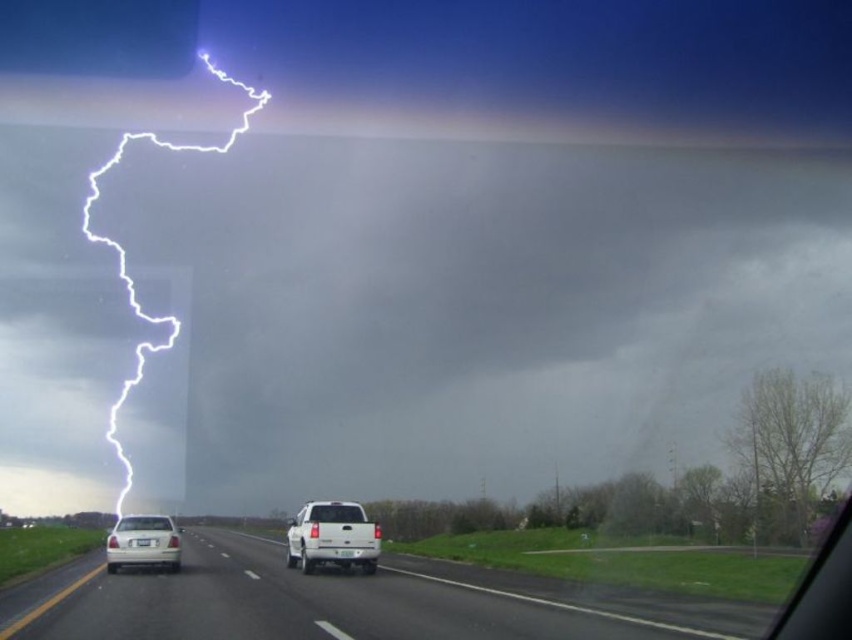
Does white matte sedan at lower left have a lesser width compared to matte white car window at lower left?

Incorrect, white matte sedan at lower left's width is not less than matte white car window at lower left's.

This screenshot has width=852, height=640. What do you see at coordinates (142, 541) in the screenshot?
I see `white matte sedan at lower left` at bounding box center [142, 541].

The image size is (852, 640). Identify the location of white matte sedan at lower left. (142, 541).

The width and height of the screenshot is (852, 640). What do you see at coordinates (337, 513) in the screenshot? I see `clear glass truck at center` at bounding box center [337, 513].

Between clear glass truck at center and matte white car window at lower left, which one appears on the right side from the viewer's perspective?

clear glass truck at center is more to the right.

Does point (330, 506) lie in front of point (140, 528)?

No, (330, 506) is behind (140, 528).

The width and height of the screenshot is (852, 640). In order to click on clear glass truck at center in this screenshot , I will do `click(337, 513)`.

Which is below, white matte sedan at lower left or clear glass truck at center?

white matte sedan at lower left is below.

Is white matte sedan at lower left to the right of clear glass truck at center from the viewer's perspective?

In fact, white matte sedan at lower left is to the left of clear glass truck at center.

Is point (137, 520) farther from viewer compared to point (355, 509)?

No, (137, 520) is closer to viewer.

Locate an element on the screen. Image resolution: width=852 pixels, height=640 pixels. white matte sedan at lower left is located at coordinates (142, 541).